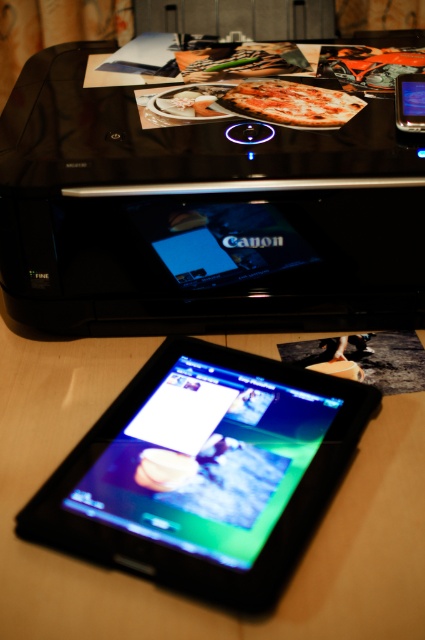
Question: Is black glossy printer at upper center smaller than slate gray plastic ipod at upper right?

Choices:
 (A) yes
 (B) no

Answer: (B)

Question: Which object appears closest to the camera in this image?

Choices:
 (A) black glossy tablet at center
 (B) black glossy printer at upper center

Answer: (A)

Question: Is black glossy tablet at center behind slate gray plastic ipod at upper right?

Choices:
 (A) no
 (B) yes

Answer: (A)

Question: Is black glossy printer at upper center in front of black glossy tablet at center?

Choices:
 (A) no
 (B) yes

Answer: (A)

Question: Which is nearer to the slate gray plastic ipod at upper right?

Choices:
 (A) black glossy printer at upper center
 (B) black glossy tablet at center

Answer: (A)

Question: Estimate the real-world distances between objects in this image. Which object is closer to the black glossy tablet at center?

Choices:
 (A) black glossy printer at upper center
 (B) slate gray plastic ipod at upper right

Answer: (A)